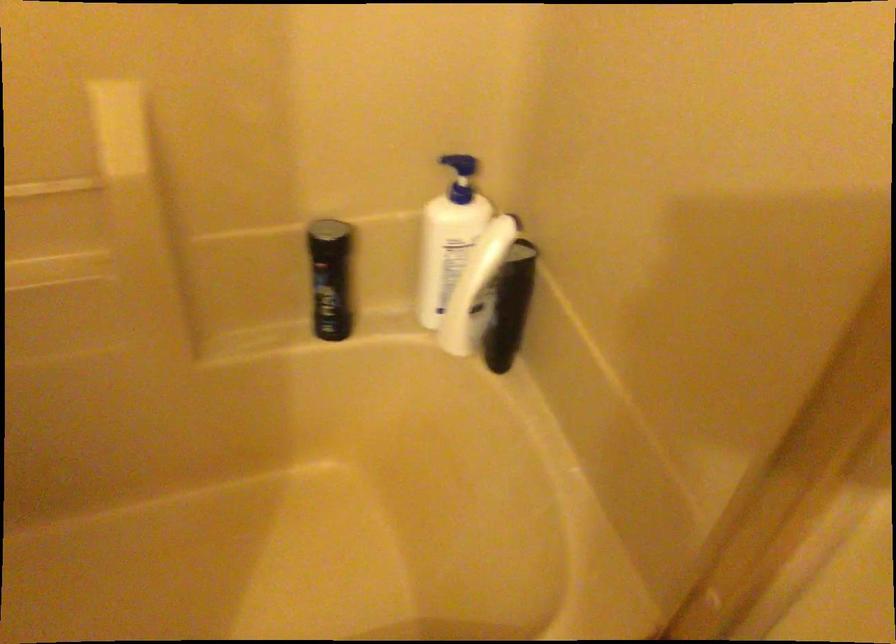
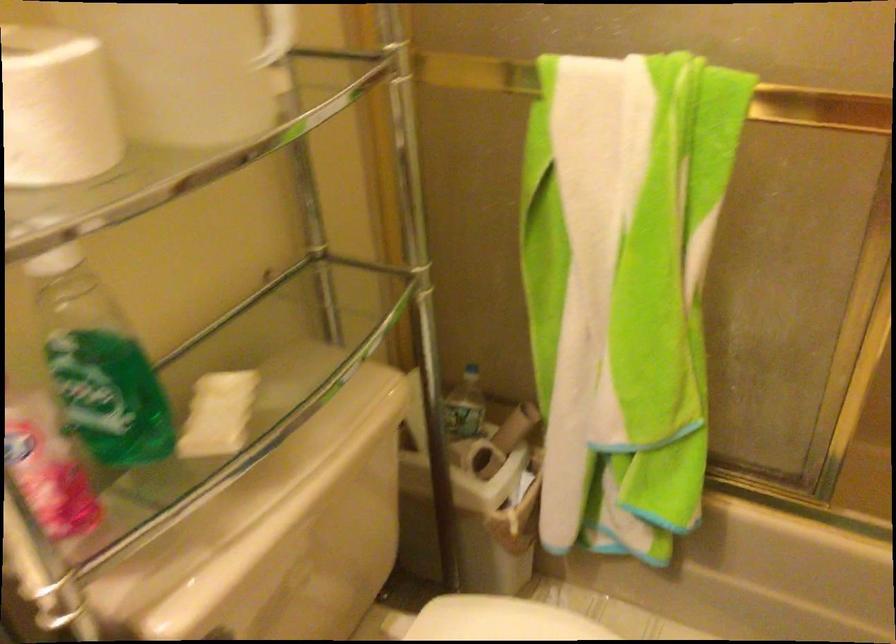
Question: How did the camera likely rotate?

Choices:
 (A) Left
 (B) Right
 (C) Up
 (D) Down

Answer: (A)